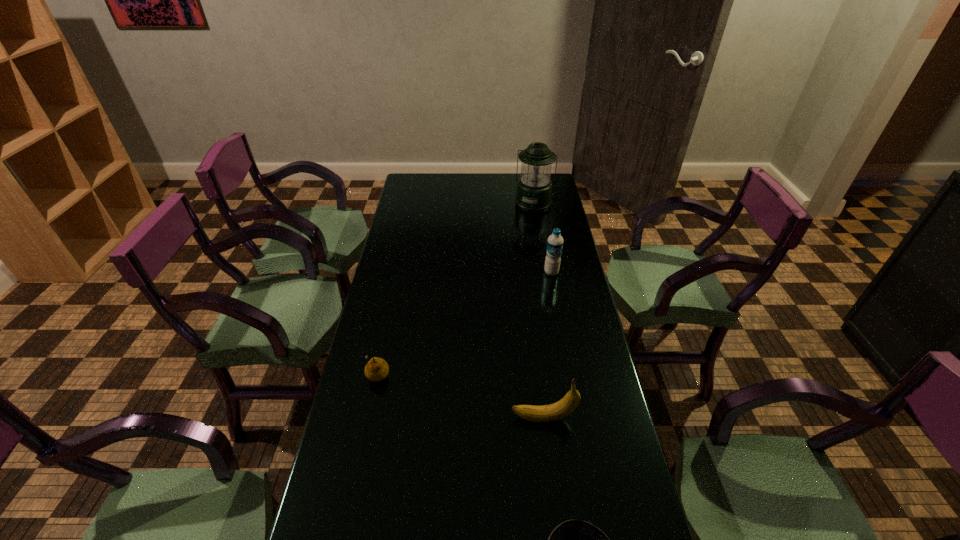
You are a GUI agent. You are given a task and a screenshot of the screen. Output one action in this format:
    pyautogui.click(x=<x>, y=<y>)
    Task: Click on the farthest object
    
    Given the screenshot: What is the action you would take?
    pyautogui.click(x=534, y=189)

Image resolution: width=960 pixels, height=540 pixels. What are the coordinates of `the tallest object` in the screenshot? It's located at (534, 189).

Identify the location of water bottle. (555, 241).

Find the location of `the second nearest object`. the second nearest object is located at coordinates (562, 408).

The width and height of the screenshot is (960, 540). I want to click on the leftmost object, so click(x=377, y=369).

Where is `the fourth tallest object`? Image resolution: width=960 pixels, height=540 pixels. the fourth tallest object is located at coordinates (377, 369).

Image resolution: width=960 pixels, height=540 pixels. I want to click on vacant point located on the back of the tallest object, so click(529, 178).

Find the location of `free space located 0.360m on the label of the water bottle`. free space located 0.360m on the label of the water bottle is located at coordinates point(566,352).

Where is `free location located at the start of the peel on the banana`? This screenshot has height=540, width=960. free location located at the start of the peel on the banana is located at coordinates (482, 418).

This screenshot has height=540, width=960. In order to click on free space located at the start of the peel on the banana in this screenshot , I will do `click(431, 418)`.